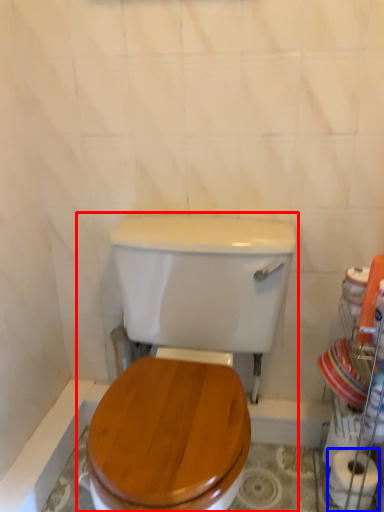
Question: Which of the following is the farthest to the observer, toilet (highlighted by a red box) or toilet paper (highlighted by a blue box)?

Choices:
 (A) toilet
 (B) toilet paper

Answer: (B)